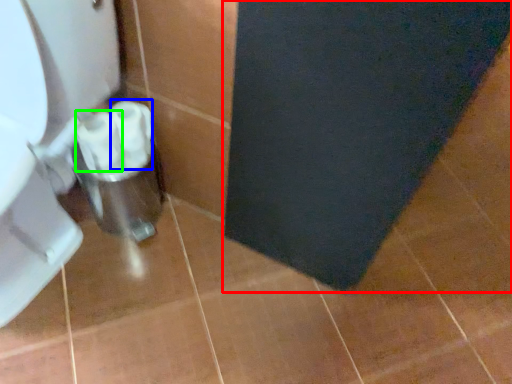
Question: Which object is positioned farthest from bath mat (highlighted by a red box)? Select from toilet paper (highlighted by a blue box) and toilet paper (highlighted by a green box).

Choices:
 (A) toilet paper
 (B) toilet paper

Answer: (B)